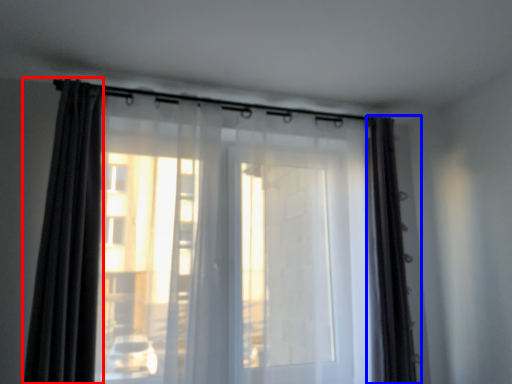
Question: Which of the following is the farthest to the observer, curtain (highlighted by a red box) or curtain (highlighted by a blue box)?

Choices:
 (A) curtain
 (B) curtain

Answer: (B)